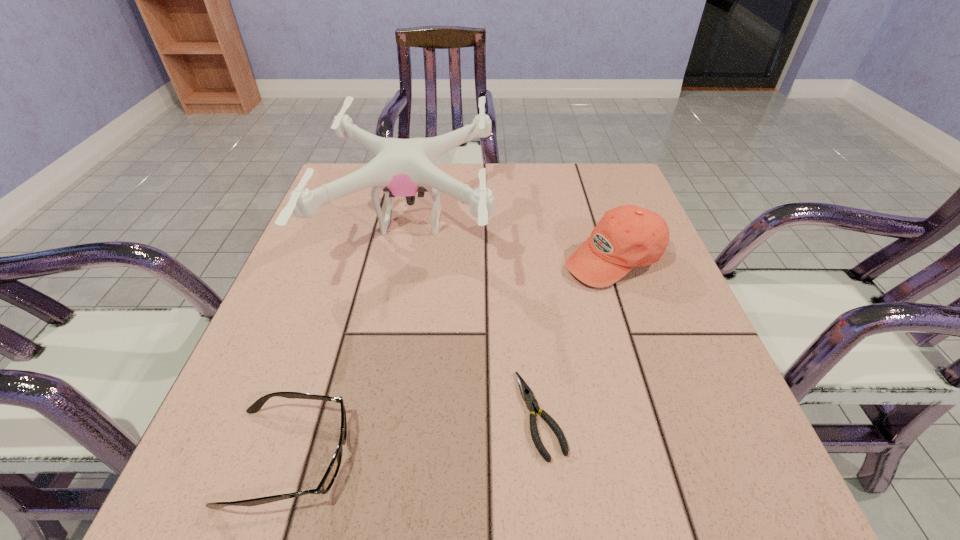
You are a GUI agent. You are given a task and a screenshot of the screen. Output one action in this format:
    pyautogui.click(x=<x>, y=<y>)
    Task: Click on the tallest object
    The width and height of the screenshot is (960, 540).
    Given the screenshot: What is the action you would take?
    pyautogui.click(x=401, y=167)

The width and height of the screenshot is (960, 540). Find the location of `the rightmost object`. the rightmost object is located at coordinates (627, 236).

What are the coordinates of `baseball cap` in the screenshot? It's located at (627, 236).

At what (x,y) coordinates should I click in order to perform the action: click on spectacles. Please return your answer as a coordinate pair (x, y). This screenshot has height=540, width=960. Looking at the image, I should click on (330, 475).

Where is `the second object from right to left`? the second object from right to left is located at coordinates (527, 394).

What are the coordinates of `pliers` in the screenshot? It's located at (527, 394).

This screenshot has width=960, height=540. Find the location of `vacant space situated on the top of the tallest object`. vacant space situated on the top of the tallest object is located at coordinates (594, 221).

The image size is (960, 540). I want to click on free spot located 0.260m on the front of the rightmost object, so click(663, 404).

I want to click on free location located 0.200m on the front-facing side of the second shortest object, so click(x=484, y=457).

I want to click on free spot located 0.300m on the back of the pliers, so click(523, 259).